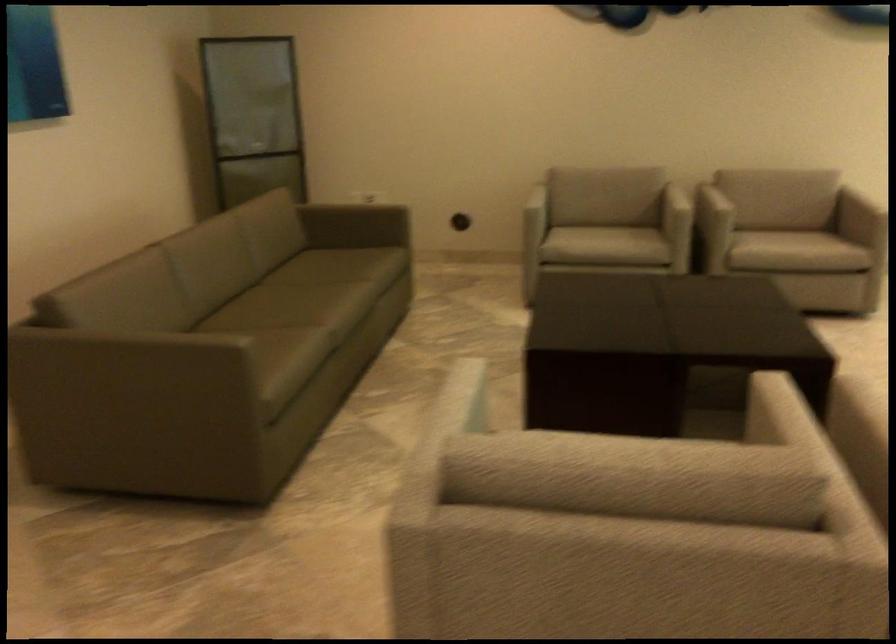
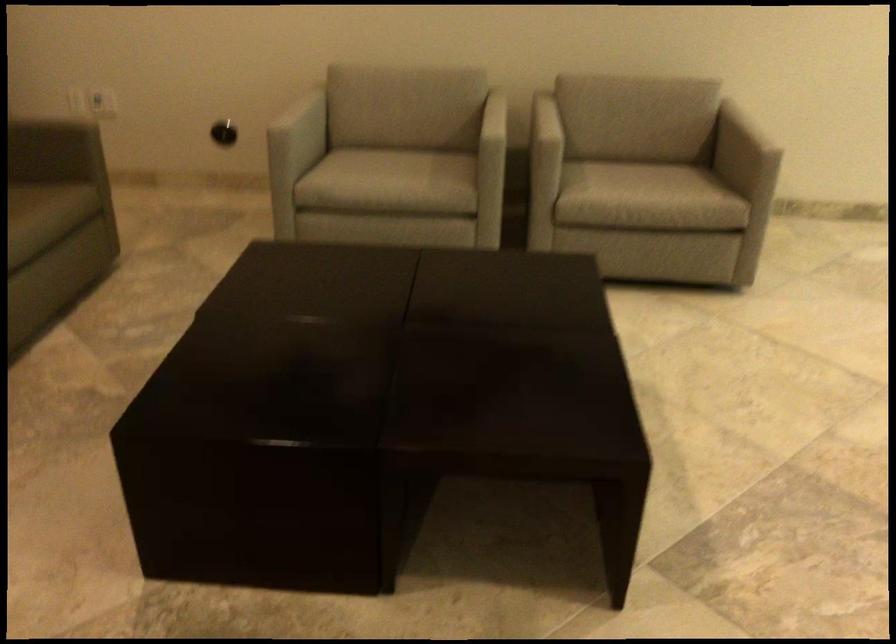
In the second image, find the point that corresponds to (x=380, y=261) in the first image.

(36, 219)